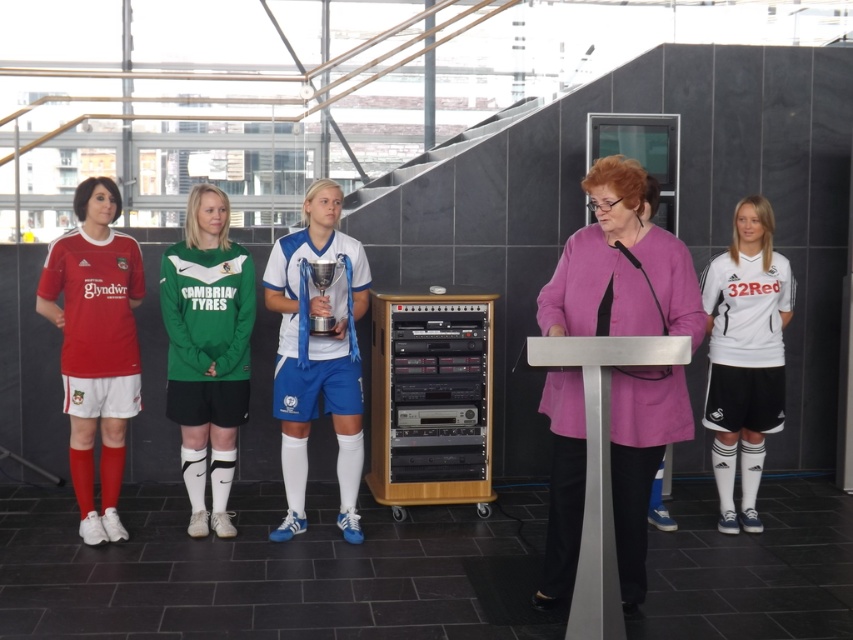
You are attending the event and want to know which of the two people in the center has a taller jersey, the green jersey at center or the white jersey at center?

The green jersey at center is taller than the white jersey at center.

You are attending the event and need to find the matte red jersey at left. Based on the coordinates provided in the description, can you determine its position relative to the podium?

The matte red jersey at left is located at point coordinates lower on the y axis than the podium, so it is positioned above the podium.